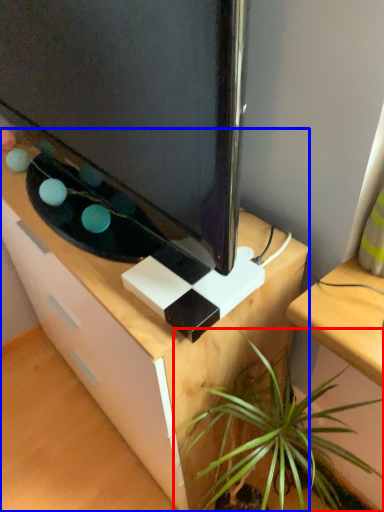
Question: Among these objects, which one is nearest to the camera, houseplant (highlighted by a red box) or desk (highlighted by a blue box)?

Choices:
 (A) houseplant
 (B) desk

Answer: (A)